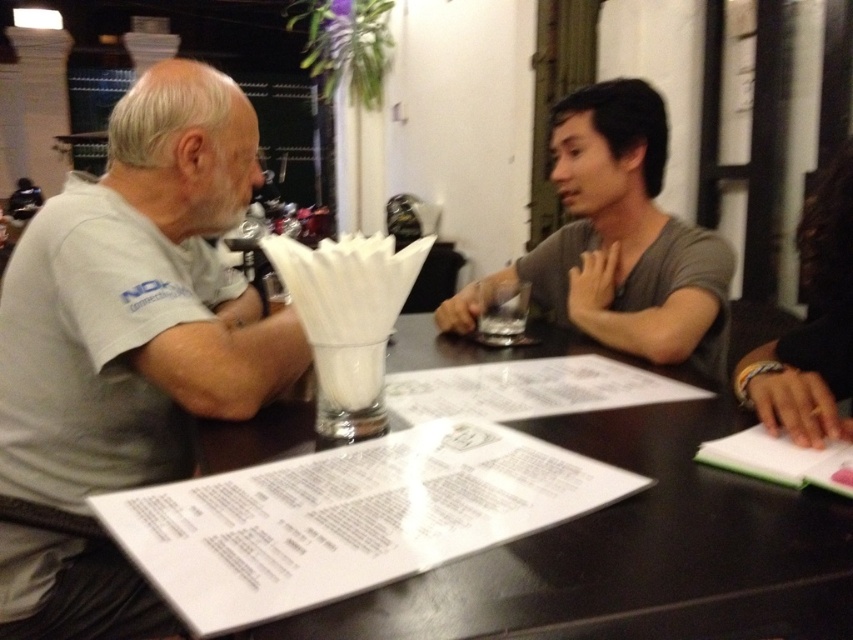
Question: Among these points, which one is nearest to the camera?

Choices:
 (A) (663, 124)
 (B) (148, 125)

Answer: (B)

Question: Considering the relative positions of gray matte shirt at center and white paper menu at center in the image provided, where is gray matte shirt at center located with respect to white paper menu at center?

Choices:
 (A) right
 (B) left

Answer: (A)

Question: Among these objects, which one is nearest to the camera?

Choices:
 (A) gray cotton shirt at left
 (B) white paper menu at center
 (C) gray matte shirt at center
 (D) black glossy table at center

Answer: (D)

Question: Which point is closer to the camera taking this photo?

Choices:
 (A) (575, 305)
 (B) (695, 493)
 (C) (419, 372)

Answer: (B)

Question: Is gray matte shirt at center to the right of white paper menu at center from the viewer's perspective?

Choices:
 (A) yes
 (B) no

Answer: (A)

Question: Observing the image, what is the correct spatial positioning of black glossy table at center in reference to gray matte shirt at center?

Choices:
 (A) right
 (B) left

Answer: (B)